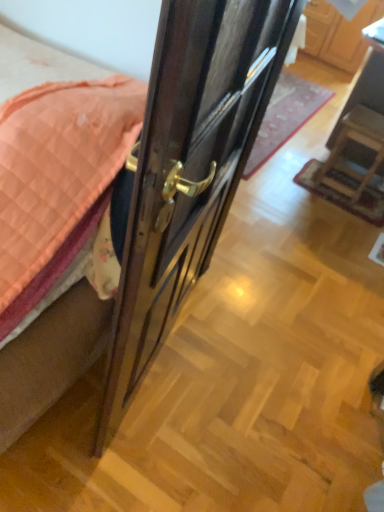
Question: From the image's perspective, is wooden cabinet at upper center located above or below polished brass door handle at center?

Choices:
 (A) above
 (B) below

Answer: (A)

Question: Considering the positions of wooden cabinet at upper center and polished brass door handle at center in the image, is wooden cabinet at upper center bigger or smaller than polished brass door handle at center?

Choices:
 (A) big
 (B) small

Answer: (A)

Question: Considering the real-world distances, which object is farthest from the brown fabric bed frame at left?

Choices:
 (A) wooden chair at right
 (B) glossy wood door at center
 (C) wooden cabinet at upper center
 (D) polished brass door handle at center

Answer: (C)

Question: Which is nearer to the brown fabric bed frame at left?

Choices:
 (A) wooden cabinet at upper center
 (B) wooden chair at right
 (C) glossy wood door at center
 (D) polished brass door handle at center

Answer: (C)